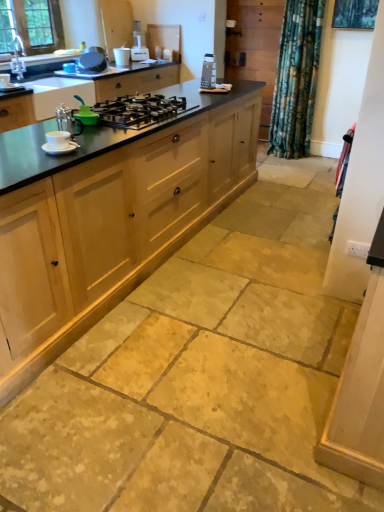
Question: Is black polished countertop at left touching white plastic toaster at upper center?

Choices:
 (A) yes
 (B) no

Answer: (B)

Question: Considering the relative sizes of black polished countertop at left and white plastic toaster at upper center in the image provided, is black polished countertop at left thinner than white plastic toaster at upper center?

Choices:
 (A) no
 (B) yes

Answer: (A)

Question: From a real-world perspective, is black polished countertop at left below white plastic toaster at upper center?

Choices:
 (A) no
 (B) yes

Answer: (B)

Question: Does black polished countertop at left have a larger size compared to white plastic toaster at upper center?

Choices:
 (A) no
 (B) yes

Answer: (B)

Question: Considering the relative sizes of black polished countertop at left and white plastic toaster at upper center in the image provided, is black polished countertop at left wider than white plastic toaster at upper center?

Choices:
 (A) yes
 (B) no

Answer: (A)

Question: Does black polished countertop at left have a smaller size compared to white plastic toaster at upper center?

Choices:
 (A) yes
 (B) no

Answer: (B)

Question: Considering the relative sizes of black matte gas stove at center and natural wood cabinetry at center in the image provided, is black matte gas stove at center bigger than natural wood cabinetry at center?

Choices:
 (A) no
 (B) yes

Answer: (A)

Question: Is black matte gas stove at center wider than natural wood cabinetry at center?

Choices:
 (A) yes
 (B) no

Answer: (B)

Question: Considering the relative sizes of black matte gas stove at center and natural wood cabinetry at center in the image provided, is black matte gas stove at center shorter than natural wood cabinetry at center?

Choices:
 (A) no
 (B) yes

Answer: (B)

Question: Is black matte gas stove at center at the left side of natural wood cabinetry at center?

Choices:
 (A) no
 (B) yes

Answer: (A)

Question: From a real-world perspective, is black matte gas stove at center located higher than natural wood cabinetry at center?

Choices:
 (A) yes
 (B) no

Answer: (A)

Question: Is black matte gas stove at center positioned beyond the bounds of natural wood cabinetry at center?

Choices:
 (A) yes
 (B) no

Answer: (B)

Question: Does natural wood cabinetry at center have a lesser height compared to matte silver sink at upper left?

Choices:
 (A) no
 (B) yes

Answer: (A)